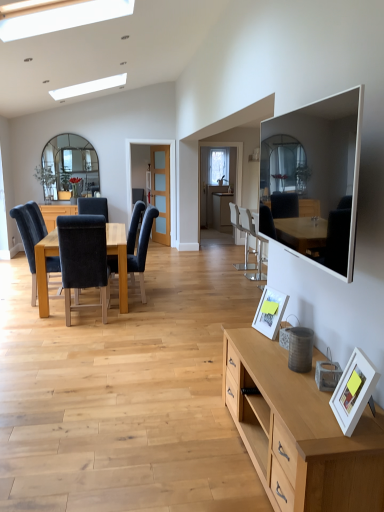
Question: Is velvet black chair at left, marked as the 4th chair in a right-to-left arrangement, to the left or to the right of white matte picture frame at lower right, which is the second picture frame from back to front, in the image?

Choices:
 (A) left
 (B) right

Answer: (A)

Question: Considering their positions, is velvet black chair at left, marked as the 4th chair in a right-to-left arrangement, located in front of or behind white matte picture frame at lower right, which is the second picture frame from back to front?

Choices:
 (A) front
 (B) behind

Answer: (B)

Question: Which object is positioned farthest from the white matte picture frame at lower right, acting as the 2th picture frame starting from the left?

Choices:
 (A) velvet dark blue chair at center left, arranged as the 5th chair when viewed from the right
 (B) white plastic chair at center, acting as the second chair starting from the right
 (C) velvet black chair at left, which is counted as the 5th chair, starting from the back
 (D) metallic silver bar stool at center, the third chair when ordered from back to front
 (E) white glossy mirror at upper right

Answer: (B)

Question: Which is farther from the white glossy mirror at upper right?

Choices:
 (A) white matte picture frame at lower right, arranged as the second picture frame when viewed from the front
 (B) velvet dark blue chair at center left, the 1th chair positioned from the left
 (C) white matte picture frame at lower right, which is the second picture frame from back to front
 (D) metallic silver bar stool at center, which ranks as the fifth chair in left-to-right order
 (E) white plastic chair at center, acting as the second chair starting from the right

Answer: (E)